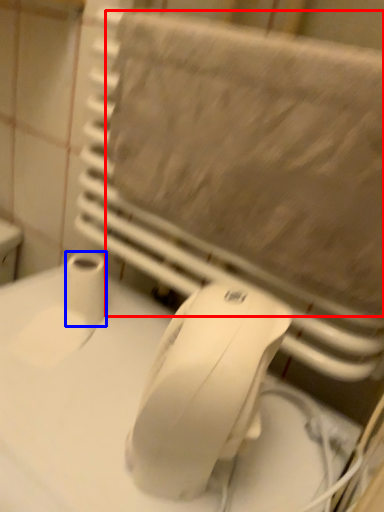
Question: Among these objects, which one is nearest to the camera, bath towel (highlighted by a red box) or toilet paper (highlighted by a blue box)?

Choices:
 (A) bath towel
 (B) toilet paper

Answer: (A)